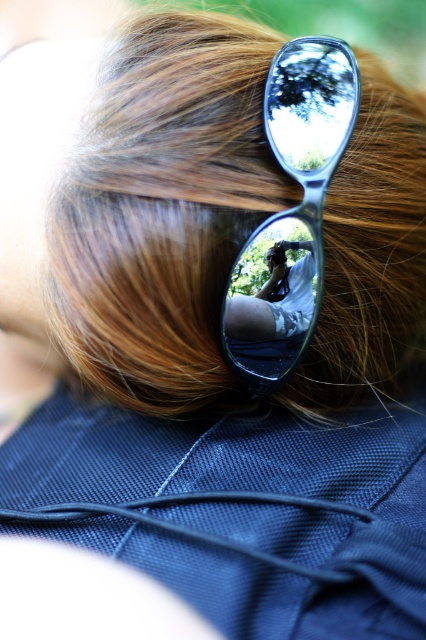
In the scene shown: Does brown shiny hair at upper center appear over metallic reflective sunglasses at center?

Indeed, brown shiny hair at upper center is positioned over metallic reflective sunglasses at center.

Locate an element on the screen. This screenshot has width=426, height=640. brown shiny hair at upper center is located at coordinates (164, 211).

At what (x,y) coordinates should I click in order to perform the action: click on brown shiny hair at upper center. Please return your answer as a coordinate pair (x, y). This screenshot has height=640, width=426. Looking at the image, I should click on (164, 211).